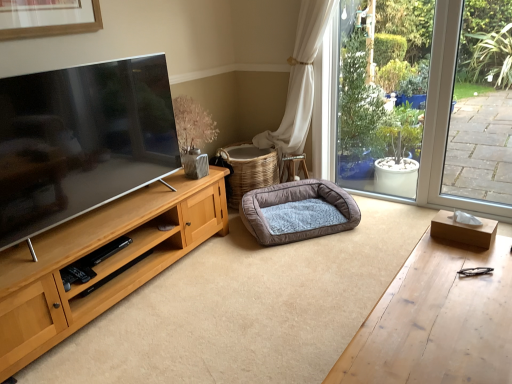
Find the location of a particular element. free space in front of brown plush dog bed at center is located at coordinates (301, 268).